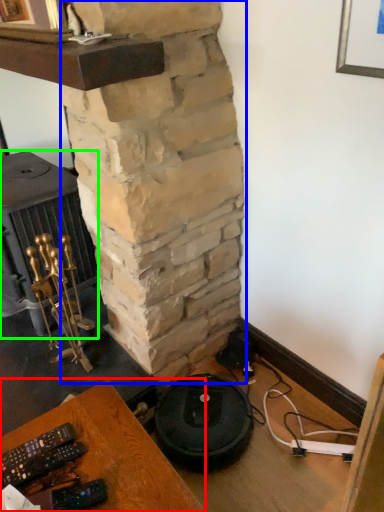
Question: Based on their relative distances, which object is farther from furniture (highlighted by a red box)? Choose from pillar (highlighted by a blue box) and stove (highlighted by a green box).

Choices:
 (A) pillar
 (B) stove

Answer: (B)